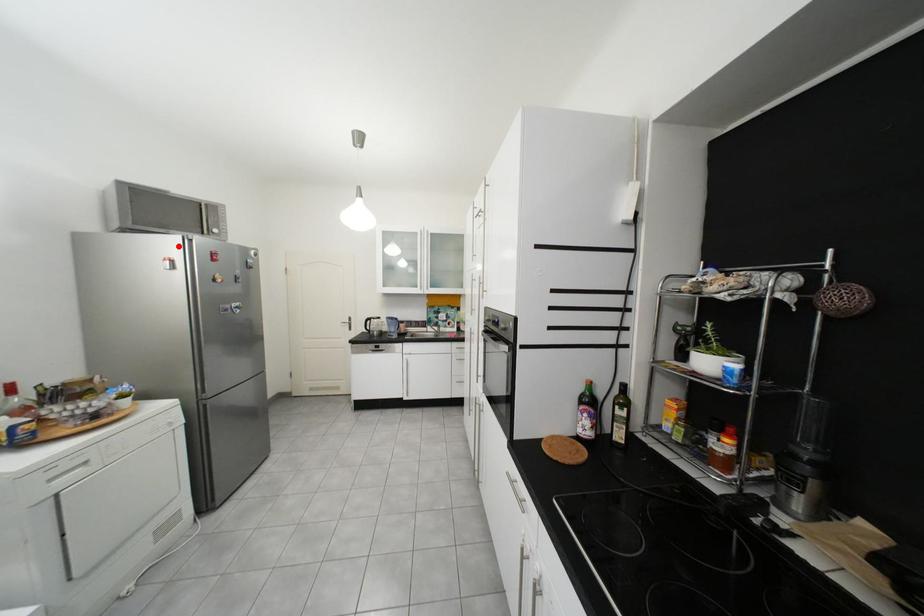
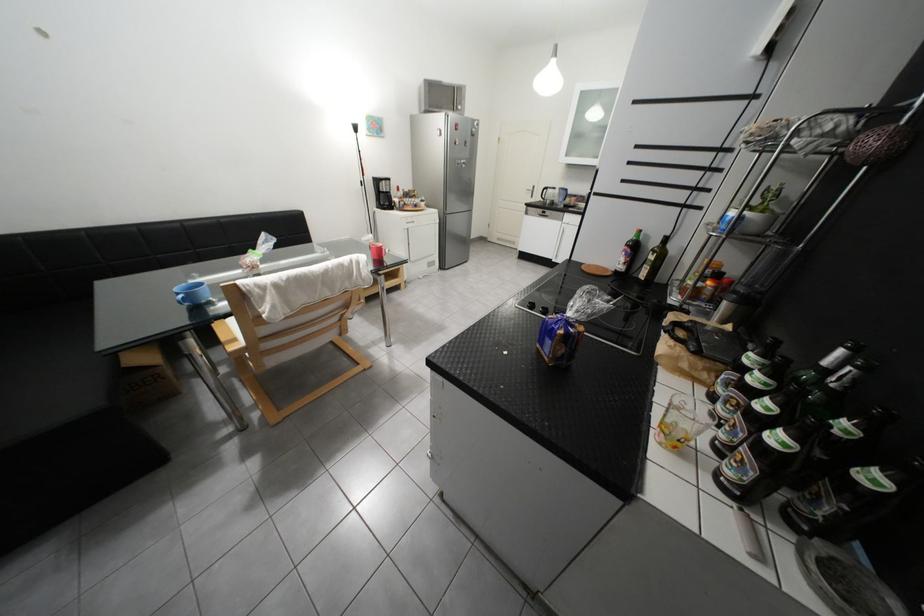
Question: I am providing you with two images of the same scene from different viewpoints. A red point is marked on the first image. Is the red point's position out of view in image 2?

Choices:
 (A) Yes
 (B) No

Answer: (B)